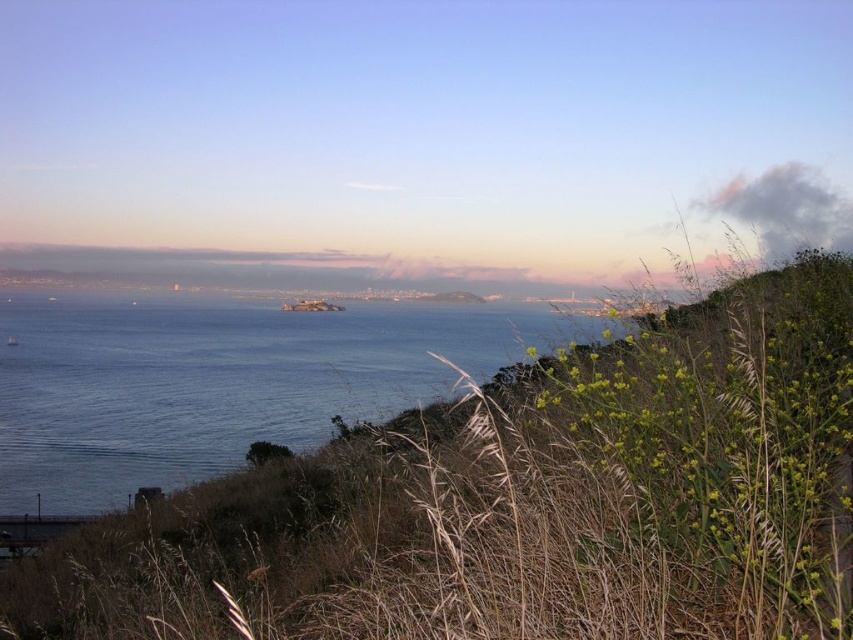
Question: Among these points, which one is farthest from the camera?

Choices:
 (A) (10, 326)
 (B) (142, 504)

Answer: (A)

Question: Is green dry grass at lower right positioned in front of blue water at center?

Choices:
 (A) yes
 (B) no

Answer: (A)

Question: Which point is farther from the camera taking this photo?

Choices:
 (A) (827, 397)
 (B) (6, 492)

Answer: (B)

Question: Where is green dry grass at lower right located in relation to blue water at center in the image?

Choices:
 (A) left
 (B) right

Answer: (B)

Question: Where is green dry grass at lower right located in relation to blue water at center in the image?

Choices:
 (A) left
 (B) right

Answer: (B)